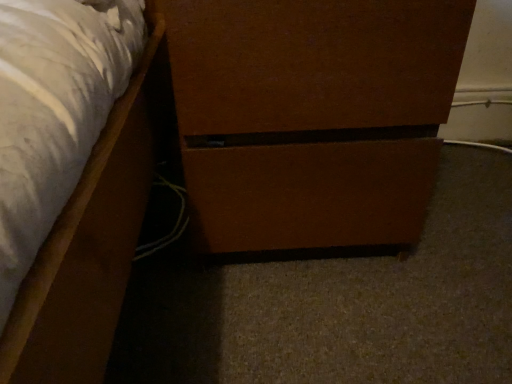
The width and height of the screenshot is (512, 384). What do you see at coordinates (312, 116) in the screenshot? I see `matte brown chest of drawers at center` at bounding box center [312, 116].

You are a GUI agent. You are given a task and a screenshot of the screen. Output one action in this format:
    pyautogui.click(x=<x>, y=<y>)
    Task: Click on the matte brown chest of drawers at center
    This screenshot has width=512, height=384.
    Given the screenshot: What is the action you would take?
    pyautogui.click(x=312, y=116)

Find the location of `matte brown chest of drawers at center`. matte brown chest of drawers at center is located at coordinates (312, 116).